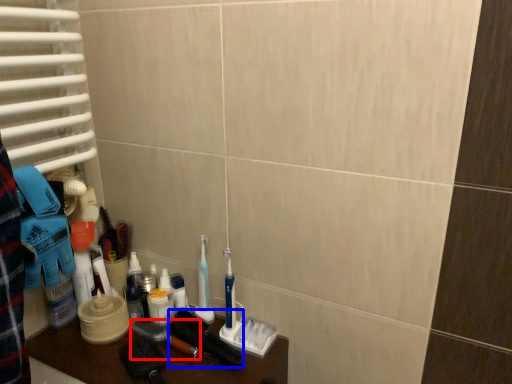
Question: Which point is further to the camera, brush (highlighted by a red box) or brush (highlighted by a blue box)?

Choices:
 (A) brush
 (B) brush

Answer: (A)